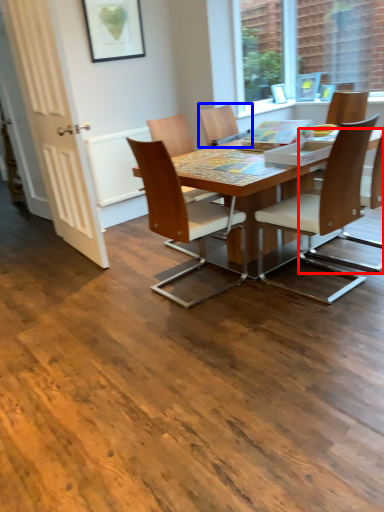
Question: Which of the following is the closest to the observer, chair (highlighted by a red box) or chair (highlighted by a blue box)?

Choices:
 (A) chair
 (B) chair

Answer: (A)